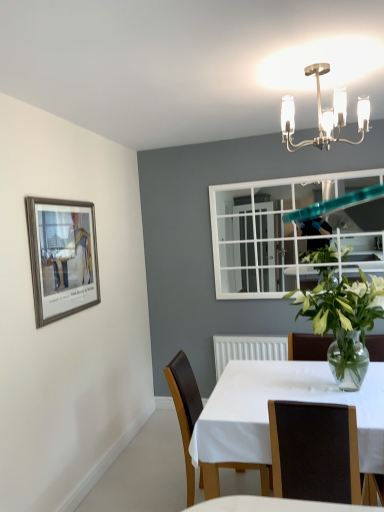
Question: From the image's perspective, is polished brass chandelier at upper center positioned above or below white glossy table at center?

Choices:
 (A) below
 (B) above

Answer: (B)

Question: Considering the positions of polished brass chandelier at upper center and white glossy table at center in the image, is polished brass chandelier at upper center wider or thinner than white glossy table at center?

Choices:
 (A) thin
 (B) wide

Answer: (A)

Question: Estimate the real-world distances between objects in this image. Which object is farther from the clear glass vase at center?

Choices:
 (A) white glossy table at center
 (B) brown leather chair at center, positioned as the 2th chair in front-to-back order
 (C) polished brass chandelier at upper center
 (D) brown leather chair at center, the 1th chair viewed from the front
 (E) silver metallic picture frame at upper left

Answer: (E)

Question: Based on their relative distances, which object is farther from the white glossy table at center?

Choices:
 (A) brown leather chair at center, positioned as the 2th chair in front-to-back order
 (B) polished brass chandelier at upper center
 (C) silver metallic picture frame at upper left
 (D) brown leather chair at center, the 1th chair viewed from the front
 (E) clear glass vase at center

Answer: (B)